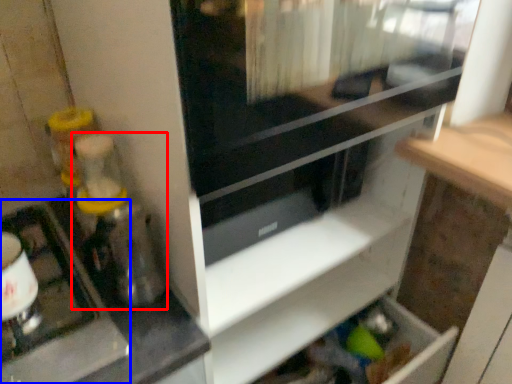
Question: Among these objects, which one is nearest to the camera, blender (highlighted by a red box) or appliance (highlighted by a blue box)?

Choices:
 (A) blender
 (B) appliance

Answer: (B)